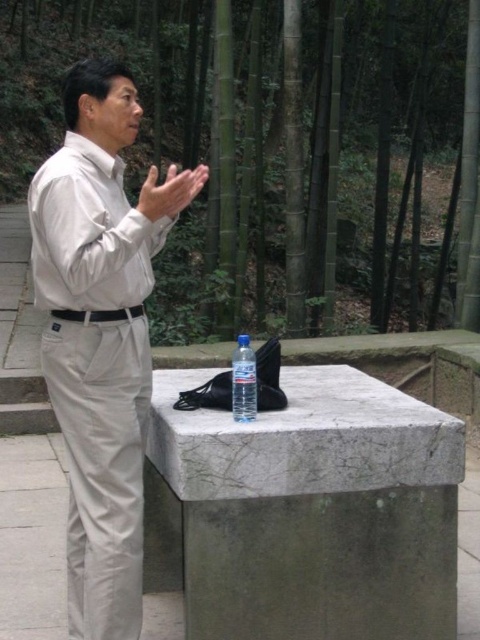
Who is more forward, (x=99, y=628) or (x=205, y=179)?

Point (x=99, y=628) is in front.

Is point (37, 243) farther from viewer compared to point (155, 205)?

That is True.

Identify the location of matte beige shirt at center. (97, 340).

Can you confirm if matte white hand at center is wider than clear plastic bottle at center?

Yes, matte white hand at center is wider than clear plastic bottle at center.

In order to click on matte white hand at center in this screenshot , I will do `click(169, 192)`.

Does white smooth shirt at center have a greater width compared to clear plastic bottle at center?

Indeed, white smooth shirt at center has a greater width compared to clear plastic bottle at center.

Who is shorter, white smooth shirt at center or clear plastic bottle at center?

Standing shorter between the two is clear plastic bottle at center.

Which is in front, point (60, 250) or point (241, 369)?

Positioned in front is point (60, 250).

At what (x,y) coordinates should I click in order to perform the action: click on white smooth shirt at center. Please return your answer as a coordinate pair (x, y). Looking at the image, I should click on (88, 232).